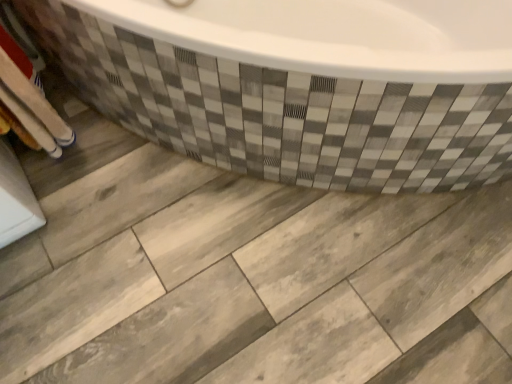
Find the location of `white glossy bathtub at upper center`. white glossy bathtub at upper center is located at coordinates (284, 109).

The image size is (512, 384). What do you see at coordinates (284, 109) in the screenshot? I see `white glossy bathtub at upper center` at bounding box center [284, 109].

Where is `white glossy bathtub at upper center`? The height and width of the screenshot is (384, 512). white glossy bathtub at upper center is located at coordinates (284, 109).